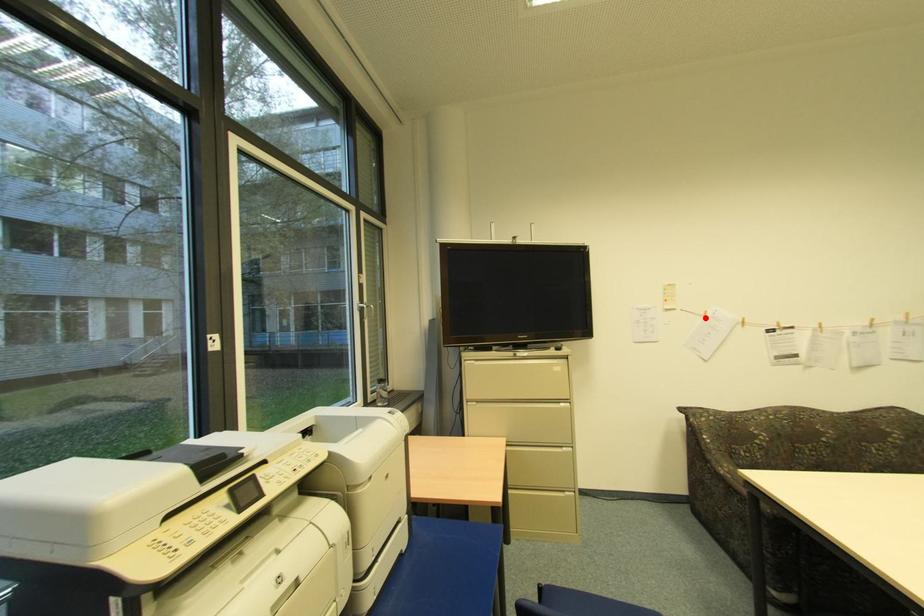
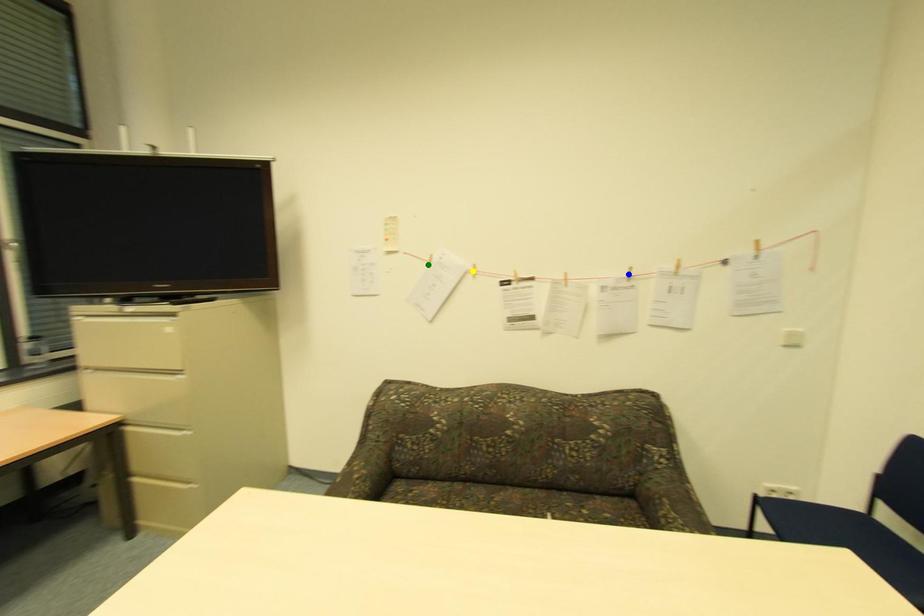
Question: I am providing you with two images of the same scene from different viewpoints. A red point is marked on the first image. You are given multiple points on the second image. Which point in image 2 is actually the same real-world point as the red point in image 1?

Choices:
 (A) blue point
 (B) yellow point
 (C) green point

Answer: (C)